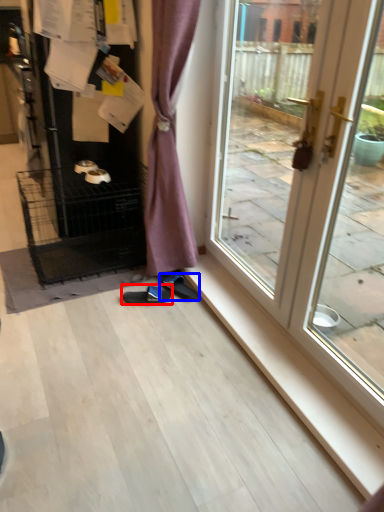
Question: Which object is further to the camera taking this photo, footwear (highlighted by a red box) or footwear (highlighted by a blue box)?

Choices:
 (A) footwear
 (B) footwear

Answer: (B)